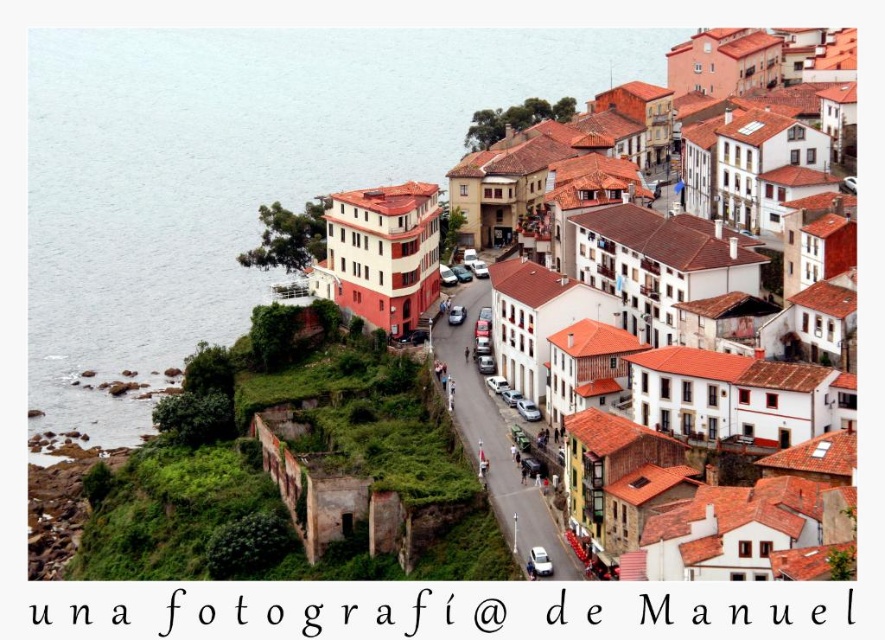
Question: Which point appears closest to the camera in this image?

Choices:
 (A) (98, 422)
 (B) (643, 504)
 (C) (545, 529)

Answer: (B)

Question: Is white matte building at center behind white stucco buildings at center?

Choices:
 (A) no
 (B) yes

Answer: (A)

Question: Which object is farther from the camera taking this photo?

Choices:
 (A) white stucco buildings at center
 (B) blue water at left
 (C) white matte building at center

Answer: (B)

Question: Can you confirm if blue water at left is positioned to the left of white stucco buildings at center?

Choices:
 (A) no
 (B) yes

Answer: (B)

Question: Does white matte building at center appear under white stucco buildings at center?

Choices:
 (A) no
 (B) yes

Answer: (A)

Question: Which point is farther to the camera?

Choices:
 (A) (445, 400)
 (B) (85, 268)

Answer: (B)